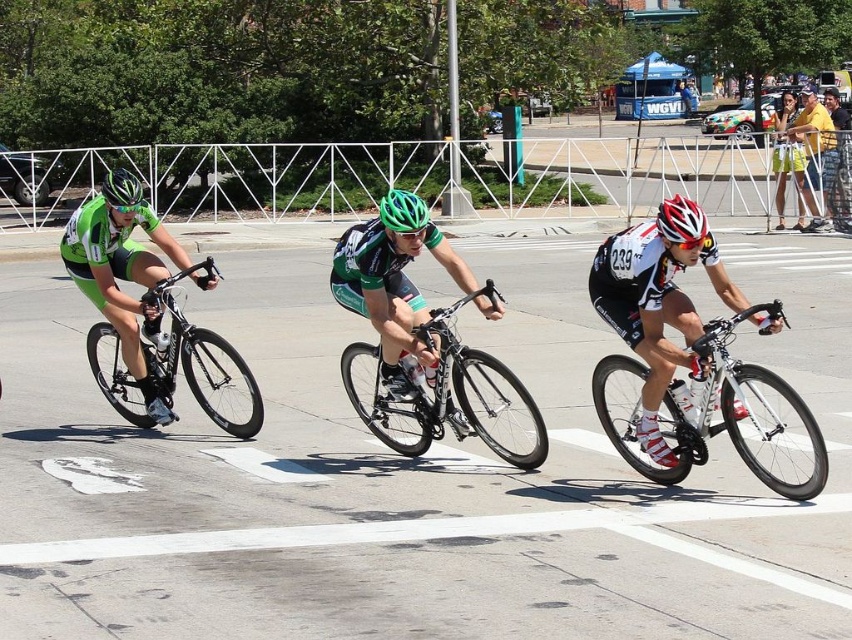
You are a photographer positioned on the sidewalk behind the fence. You want to take a photo of the cyclists so that both the green fabric jersey at left and the white matte bicycle at center are clearly visible in the frame. Based on their positions, which cyclist should you focus on to ensure both are in the shot?

The green fabric jersey at left is positioned on the left side of the white matte bicycle at center, so focusing on the cyclist wearing the green fabric jersey at left will ensure both the jersey and the white matte bicycle at center are visible in the frame.

Based on the photo, you are a spectator standing on the sidewalk behind the metal fence. You see the green fabric jersey at left and the white matte bicycle at center. Which one is closer to you?

The green fabric jersey at left is closer to you because the white matte bicycle at center is behind it.

You are a photographer positioned on the sidewalk behind the fence. You want to capture a photo of the green fabric jersey at left and the white matte bicycle at center. Based on their heights, which object will appear larger in your photo?

The green fabric jersey at left is much taller than the white matte bicycle at center, so it will appear larger in the photo.